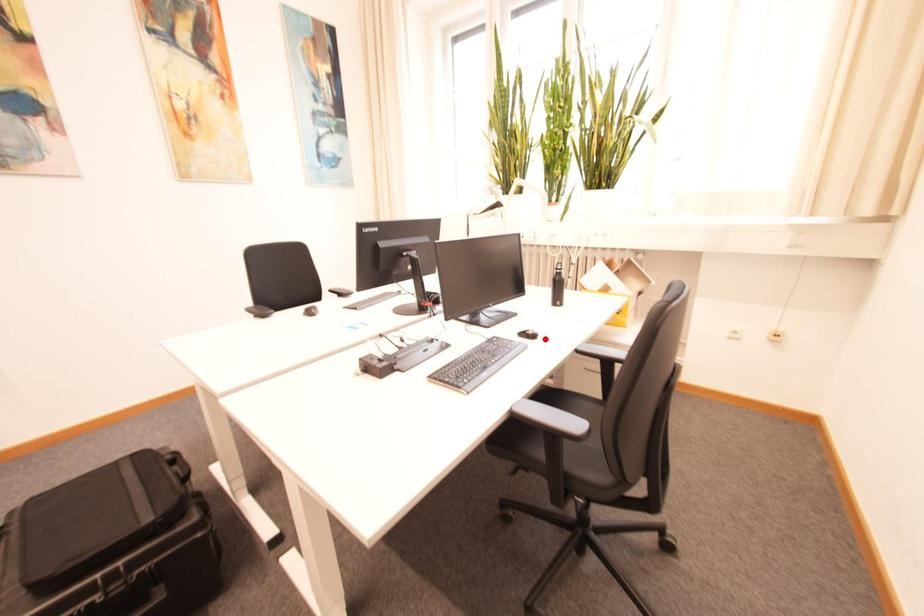
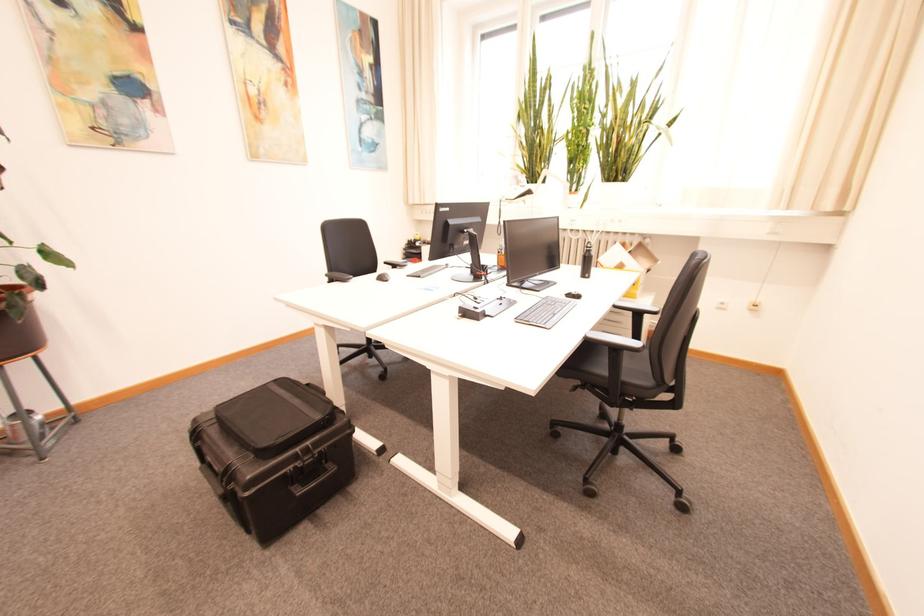
Find the pixel in the second image that matches the highlighted location in the first image.

(589, 299)